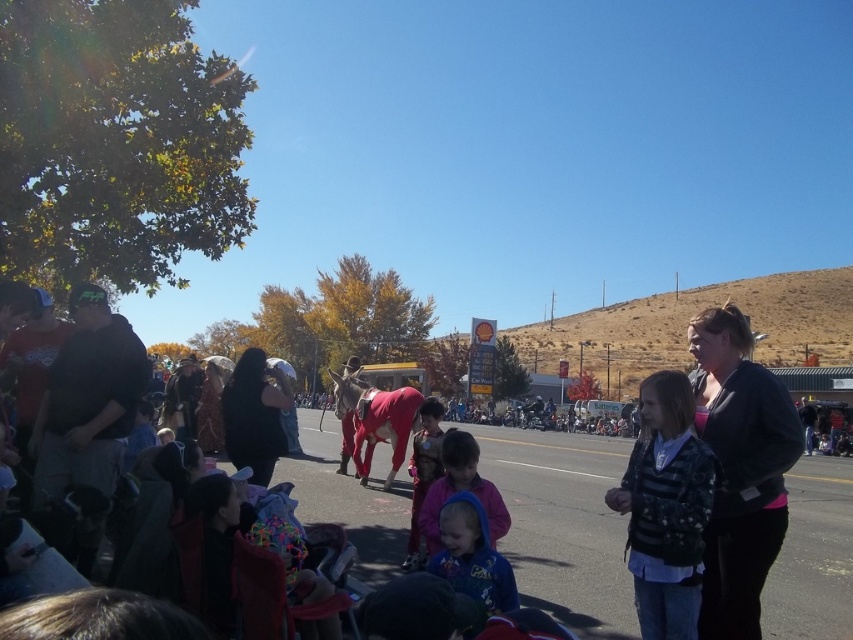
Is red fabric donkey at center thinner than striped sweater at center?

Incorrect, red fabric donkey at center's width is not less than striped sweater at center's.

Does red fabric donkey at center appear under striped sweater at center?

Indeed, red fabric donkey at center is positioned under striped sweater at center.

Is point (633, 611) less distant than point (689, 620)?

No, (633, 611) is further to viewer.

Identify the location of red fabric donkey at center. (563, 524).

Image resolution: width=853 pixels, height=640 pixels. In order to click on red fabric donkey at center in this screenshot , I will do `click(563, 524)`.

The width and height of the screenshot is (853, 640). What are the coordinates of `striped sweater at center` in the screenshot? It's located at (665, 508).

Does striped sweater at center have a smaller size compared to blue fleece jacket at center?

Indeed, striped sweater at center has a smaller size compared to blue fleece jacket at center.

Who is more distant from viewer, (x=701, y=568) or (x=425, y=534)?

Positioned behind is point (x=425, y=534).

This screenshot has height=640, width=853. I want to click on striped sweater at center, so click(x=665, y=508).